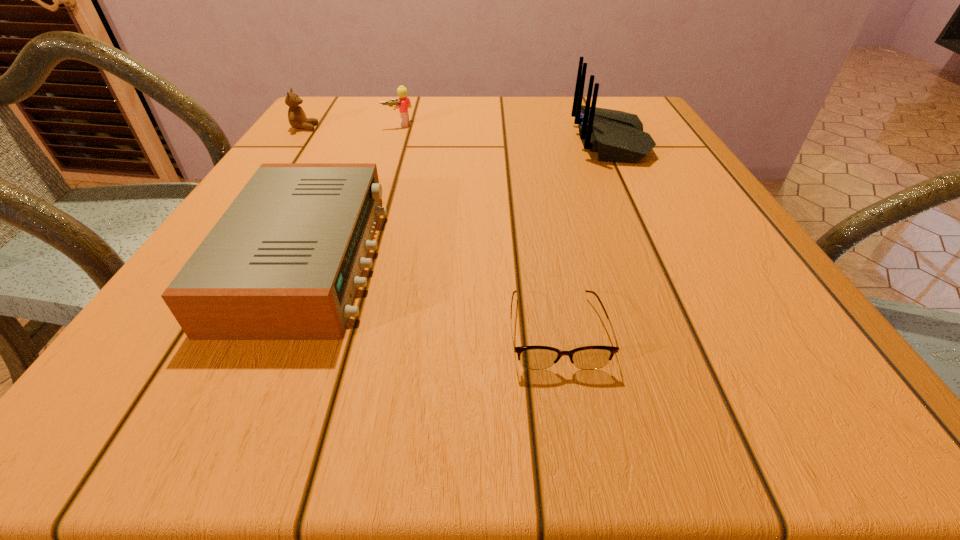
Where is `object that is at the far left corner`? Image resolution: width=960 pixels, height=540 pixels. object that is at the far left corner is located at coordinates (297, 118).

Find the location of `object present at the far right corner`. object present at the far right corner is located at coordinates (617, 136).

I want to click on free space at the far edge, so click(501, 109).

In the image, there is a desktop. Identify the location of vacant area at the near edge. (718, 404).

At what (x,y) coordinates should I click in order to perform the action: click on vacant position at the left edge of the desktop. Please return your answer as a coordinate pair (x, y). Looking at the image, I should click on (286, 154).

This screenshot has width=960, height=540. What are the coordinates of `vacant region at the right edge of the desktop` in the screenshot? It's located at [683, 193].

The image size is (960, 540). Find the location of `free region at the far left corner`. free region at the far left corner is located at coordinates (357, 129).

Where is `free location at the near left corner of the desktop`? The height and width of the screenshot is (540, 960). free location at the near left corner of the desktop is located at coordinates coord(166,406).

In the image, there is a desktop. Find the location of `vacant space at the far right corner`. vacant space at the far right corner is located at coordinates (641, 104).

The width and height of the screenshot is (960, 540). I want to click on free space at the near right corner, so click(792, 377).